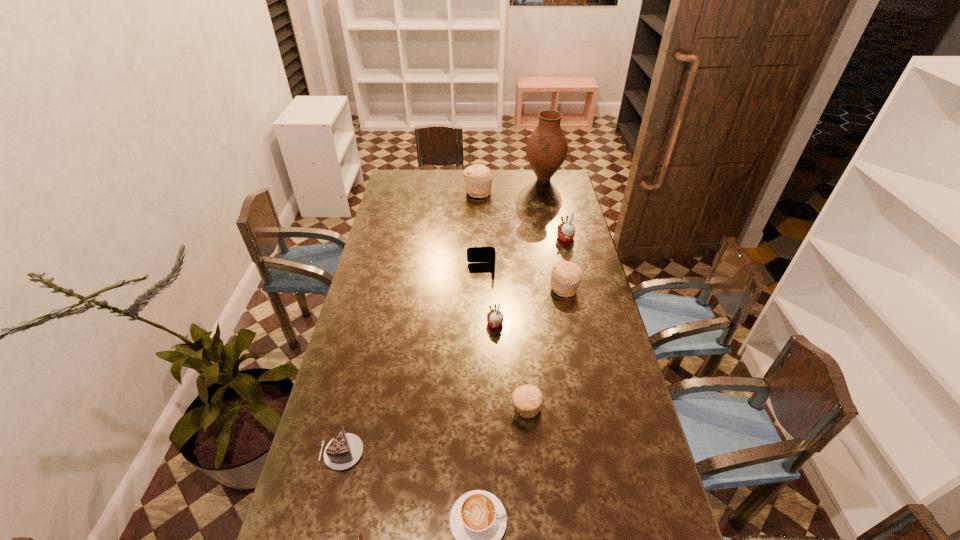
You are a GUI agent. You are given a task and a screenshot of the screen. Output one action in this format:
    pyautogui.click(x=<x>, y=<y>)
    Task: Click on the vacant area situated 0.110m on the front-facing side of the smaller pink muffin
    Image resolution: width=960 pixels, height=540 pixels.
    Given the screenshot: What is the action you would take?
    pyautogui.click(x=456, y=324)

Where is `vacant region located on the front-facing side of the smaller pink muffin`? Image resolution: width=960 pixels, height=540 pixels. vacant region located on the front-facing side of the smaller pink muffin is located at coordinates (447, 324).

Identify the location of vacant region located on the right of the nearest muffin. (625, 408).

Locate an element on the screen. vacant space located on the outer surface of the wallet is located at coordinates (410, 271).

You are a GUI agent. You are given a task and a screenshot of the screen. Output one action in this format:
    pyautogui.click(x=<x>, y=<y>)
    Task: Click on the free space located 0.220m on the outer surface of the wallet
    The width and height of the screenshot is (960, 540).
    Given the screenshot: What is the action you would take?
    pyautogui.click(x=412, y=271)

Locate an element on the screen. vacant space located on the outer surface of the wallet is located at coordinates (424, 271).

In order to click on free location located 0.320m on the right of the third nearest object in this screenshot , I will do `click(480, 453)`.

Identify the location of vase at the far edge. (546, 150).

The image size is (960, 540). I want to click on muffin that is at the far edge, so click(478, 178).

This screenshot has width=960, height=540. I want to click on object that is at the left edge, so click(x=345, y=449).